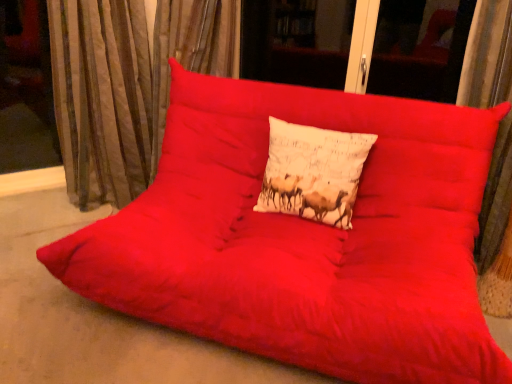
Identify the location of white cotton cushion at center. (313, 172).

What do you see at coordinates (313, 172) in the screenshot?
I see `white cotton cushion at center` at bounding box center [313, 172].

What do you see at coordinates (126, 85) in the screenshot? I see `velvet-like brown curtain at left` at bounding box center [126, 85].

Image resolution: width=512 pixels, height=384 pixels. Find the location of `velvet-like brown curtain at left`. velvet-like brown curtain at left is located at coordinates (126, 85).

Measure the distance between point (84, 77) and camera.

Point (84, 77) is 2.13 meters away from camera.

At what (x,y) coordinates should I click in order to perform the action: click on white cotton cushion at center. Please return your answer as a coordinate pair (x, y). The width and height of the screenshot is (512, 384). Looking at the image, I should click on (313, 172).

Would you say white cotton cushion at center is to the left or to the right of velvet-like brown curtain at left in the picture?

In the image, white cotton cushion at center appears on the right side of velvet-like brown curtain at left.

Is white cotton cushion at center positioned before velvet-like brown curtain at left?

Yes, white cotton cushion at center is closer to the viewer.

Considering the points (353, 182) and (144, 49), which point is behind, point (353, 182) or point (144, 49)?

Positioned behind is point (144, 49).

From the image's perspective, does white cotton cushion at center appear higher than velvet-like brown curtain at left?

No, from the image's perspective, white cotton cushion at center is not on top of velvet-like brown curtain at left.

From a real-world perspective, which object rests below the other?

white cotton cushion at center is physically lower.

In the scene shown: Can you confirm if white cotton cushion at center is wider than velvet-like brown curtain at left?

Incorrect, the width of white cotton cushion at center does not surpass that of velvet-like brown curtain at left.

Does white cotton cushion at center have a greater height compared to velvet-like brown curtain at left?

No, white cotton cushion at center is not taller than velvet-like brown curtain at left.

Does white cotton cushion at center have a larger size compared to velvet-like brown curtain at left?

Actually, white cotton cushion at center might be smaller than velvet-like brown curtain at left.

Is white cotton cushion at center outside of velvet-like brown curtain at left?

Yes, white cotton cushion at center is outside of velvet-like brown curtain at left.

Are white cotton cushion at center and velvet-like brown curtain at left far apart?

They are positioned close to each other.

Does white cotton cushion at center turn towards velvet-like brown curtain at left?

No.

Identify the location of curtain above the white cotton cushion at center (from the image's perspective). (126, 85).

Considering the relative positions of velvet-like brown curtain at left and white cotton cushion at center in the image provided, is velvet-like brown curtain at left to the right of white cotton cushion at center from the viewer's perspective?

Incorrect, velvet-like brown curtain at left is not on the right side of white cotton cushion at center.

Is velvet-like brown curtain at left in front of white cotton cushion at center?

No, velvet-like brown curtain at left is behind white cotton cushion at center.

Is point (127, 65) more distant than point (291, 201)?

Yes.

From the image's perspective, which one is positioned lower, velvet-like brown curtain at left or white cotton cushion at center?

white cotton cushion at center, from the image's perspective.

From a real-world perspective, between velvet-like brown curtain at left and white cotton cushion at center, who is vertically higher?

velvet-like brown curtain at left, from a real-world perspective.

Between velvet-like brown curtain at left and white cotton cushion at center, which one has smaller width?

white cotton cushion at center.

Considering the sizes of objects velvet-like brown curtain at left and white cotton cushion at center in the image provided, who is taller, velvet-like brown curtain at left or white cotton cushion at center?

velvet-like brown curtain at left is taller.

Between velvet-like brown curtain at left and white cotton cushion at center, which one has larger size?

velvet-like brown curtain at left is bigger.

Looking at this image, is white cotton cushion at center a part of velvet-like brown curtain at left?

No, white cotton cushion at center is not inside velvet-like brown curtain at left.

Is velvet-like brown curtain at left not close to white cotton cushion at center?

Actually, velvet-like brown curtain at left and white cotton cushion at center are a little close together.

Is velvet-like brown curtain at left turned away from white cotton cushion at center?

No, white cotton cushion at center is not at the back of velvet-like brown curtain at left.

How different are the orientations of velvet-like brown curtain at left and white cotton cushion at center in degrees?

The angle between the facing direction of velvet-like brown curtain at left and the facing direction of white cotton cushion at center is 5.15 degrees.

Find the location of a particular element. The width and height of the screenshot is (512, 384). curtain on the left side of white cotton cushion at center is located at coordinates (126, 85).

Locate an element on the screen. The height and width of the screenshot is (384, 512). curtain above the white cotton cushion at center (from a real-world perspective) is located at coordinates (126, 85).

Identify the location of pillow below the velvet-like brown curtain at left (from the image's perspective). (313, 172).